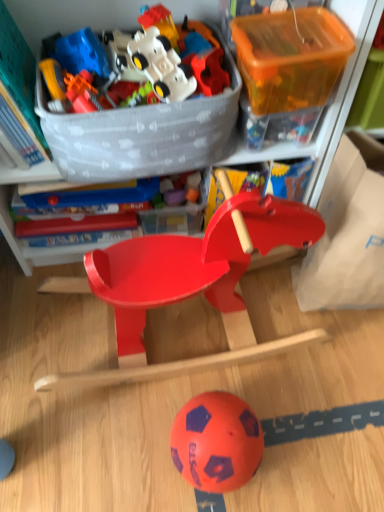
Find the location of a particular element. This screenshot has width=384, height=512. orange rubber ball at lower center is located at coordinates (216, 442).

Locate an element on the screen. translucent plastic storage box at upper center, which appears as the third storage box when viewed from the right is located at coordinates (179, 214).

The height and width of the screenshot is (512, 384). What are the coordinates of `white plastic toy car at upper center, acting as the third toy starting from the top` in the screenshot? It's located at (138, 60).

Identify the location of translucent plastic toy at upper left, which appears as the second toy when ordered from the bottom. This screenshot has width=384, height=512. (80, 92).

Where is `orange rubber ball at lower center`? The width and height of the screenshot is (384, 512). orange rubber ball at lower center is located at coordinates (x=216, y=442).

Which object is thinner, white matte plastic toy car at upper center, the 1th toy when ordered from top to bottom, or translucent plastic storage box at upper center, which is the 1th storage box from left to right?

white matte plastic toy car at upper center, the 1th toy when ordered from top to bottom, is thinner.

Considering the relative positions of white matte plastic toy car at upper center, the 1th toy when ordered from top to bottom, and translucent plastic storage box at upper center, which is the 1th storage box from left to right, in the image provided, is white matte plastic toy car at upper center, the 1th toy when ordered from top to bottom, in front of translucent plastic storage box at upper center, which is the 1th storage box from left to right,?

Yes.

From the image's perspective, is white matte plastic toy car at upper center, the 1th toy when ordered from top to bottom, below translucent plastic storage box at upper center, which is the 1th storage box from left to right?

No, from the image's perspective, white matte plastic toy car at upper center, the 1th toy when ordered from top to bottom, is not beneath translucent plastic storage box at upper center, which is the 1th storage box from left to right.

Can you confirm if white matte plastic toy car at upper center, the 1th toy when ordered from top to bottom, is shorter than translucent plastic storage box at upper center, which appears as the third storage box when viewed from the right?

Correct, white matte plastic toy car at upper center, the 1th toy when ordered from top to bottom, is not as tall as translucent plastic storage box at upper center, which appears as the third storage box when viewed from the right.

Could you tell me if rubberized plastic toy at upper center, the 4th toy viewed from the top, is turned towards translucent plastic toy at upper left, the 5th toy in the top-to-bottom sequence?

No, rubberized plastic toy at upper center, the 4th toy viewed from the top, is not turned towards translucent plastic toy at upper left, the 5th toy in the top-to-bottom sequence.

From a real-world perspective, is rubberized plastic toy at upper center, the third toy when ordered from bottom to top, located beneath translucent plastic toy at upper left, which appears as the second toy when ordered from the bottom?

No.

Considering their positions, is rubberized plastic toy at upper center, the third toy when ordered from bottom to top, located in front of or behind translucent plastic toy at upper left, the 5th toy in the top-to-bottom sequence?

In the image, rubberized plastic toy at upper center, the third toy when ordered from bottom to top, appears behind translucent plastic toy at upper left, the 5th toy in the top-to-bottom sequence.

Considering the relative sizes of matte plastic storage box at right, arranged as the first storage box when viewed from the right, and white matte plastic toy car at upper center, the 1th toy when ordered from top to bottom, in the image provided, is matte plastic storage box at right, arranged as the first storage box when viewed from the right, smaller than white matte plastic toy car at upper center, the 1th toy when ordered from top to bottom,?

Actually, matte plastic storage box at right, arranged as the first storage box when viewed from the right, might be larger than white matte plastic toy car at upper center, the 1th toy when ordered from top to bottom.

Consider the image. From the image's perspective, is matte plastic storage box at right, arranged as the first storage box when viewed from the right, on top of white matte plastic toy car at upper center, the 1th toy when ordered from top to bottom?

No, from the image's perspective, matte plastic storage box at right, arranged as the first storage box when viewed from the right, is not above white matte plastic toy car at upper center, the 1th toy when ordered from top to bottom.

Locate an element on the screen. Image resolution: width=384 pixels, height=512 pixels. storage box that is the 3rd object located below the white matte plastic toy car at upper center, the 1th toy when ordered from top to bottom (from the image's perspective) is located at coordinates (346, 239).

Between matte plastic storage box at right, arranged as the first storage box when viewed from the right, and white matte plastic toy car at upper center, the 1th toy when ordered from top to bottom, which one appears on the left side from the viewer's perspective?

From the viewer's perspective, white matte plastic toy car at upper center, the 1th toy when ordered from top to bottom, appears more on the left side.

Can you tell me how much white matte plastic toy car at upper center, the 1th toy when ordered from top to bottom, and translucent plastic toy at upper left, the 5th toy in the top-to-bottom sequence, differ in facing direction?

The angular difference between white matte plastic toy car at upper center, the 1th toy when ordered from top to bottom, and translucent plastic toy at upper left, the 5th toy in the top-to-bottom sequence, is 5.6e-05 degrees.

Which is less distant, (156, 15) or (85, 82)?

Clearly, point (156, 15) is more distant from the camera than point (85, 82).

Is white matte plastic toy car at upper center, the 1th toy when ordered from top to bottom, at the left side of translucent plastic toy at upper left, the 5th toy in the top-to-bottom sequence?

No, white matte plastic toy car at upper center, the 1th toy when ordered from top to bottom, is not to the left of translucent plastic toy at upper left, the 5th toy in the top-to-bottom sequence.

Is white matte plastic toy car at upper center, the 1th toy when ordered from top to bottom, turned away from translucent plastic toy at upper left, the 5th toy in the top-to-bottom sequence?

No, translucent plastic toy at upper left, the 5th toy in the top-to-bottom sequence, is not at the back of white matte plastic toy car at upper center, the 1th toy when ordered from top to bottom.

Between rubberized plastic toy at upper center, the 4th toy viewed from the top, and matte plastic toy car at upper center, which is the fifth toy in bottom-to-top order, which one appears on the right side from the viewer's perspective?

rubberized plastic toy at upper center, the 4th toy viewed from the top, is more to the right.

Is there a large distance between rubberized plastic toy at upper center, the third toy when ordered from bottom to top, and matte plastic toy car at upper center, which is the fifth toy in bottom-to-top order?

Actually, rubberized plastic toy at upper center, the third toy when ordered from bottom to top, and matte plastic toy car at upper center, which is the fifth toy in bottom-to-top order, are a little close together.

Can you confirm if rubberized plastic toy at upper center, the 4th toy viewed from the top, is shorter than matte plastic toy car at upper center, which ranks as the second toy in top-to-bottom order?

No.

Does matte plastic toy car at upper center, which is the fifth toy in bottom-to-top order, have a larger size compared to rubberized plastic toy at upper center, the 4th toy viewed from the top?

Actually, matte plastic toy car at upper center, which is the fifth toy in bottom-to-top order, might be smaller than rubberized plastic toy at upper center, the 4th toy viewed from the top.

Considering the sizes of objects matte plastic toy car at upper center, which is the fifth toy in bottom-to-top order, and rubberized plastic toy at upper center, the 4th toy viewed from the top, in the image provided, who is thinner, matte plastic toy car at upper center, which is the fifth toy in bottom-to-top order, or rubberized plastic toy at upper center, the 4th toy viewed from the top,?

matte plastic toy car at upper center, which is the fifth toy in bottom-to-top order, is thinner.

Who is more distant, matte plastic toy car at upper center, which is the fifth toy in bottom-to-top order, or rubberized plastic toy at upper center, the 4th toy viewed from the top?

matte plastic toy car at upper center, which is the fifth toy in bottom-to-top order, is further away from the camera.

Considering the positions of point (202, 48) and point (216, 56), is point (202, 48) closer or farther from the camera than point (216, 56)?

Point (202, 48) is positioned closer to the camera compared to point (216, 56).

Is matte plastic rocking horse at center, the 6th toy viewed from the top, shorter than translucent orange plastic storage box at upper right, which ranks as the 2th storage box in right-to-left order?

Incorrect, the height of matte plastic rocking horse at center, the 6th toy viewed from the top, does not fall short of that of translucent orange plastic storage box at upper right, which ranks as the 2th storage box in right-to-left order.

In the scene shown: Is matte plastic rocking horse at center, the 6th toy viewed from the top, to the left of translucent orange plastic storage box at upper right, which ranks as the 2th storage box in right-to-left order, from the viewer's perspective?

Yes.

There is a matte plastic rocking horse at center, the 6th toy viewed from the top. Where is `the 3rd storage box above it (from the image's perspective)`? the 3rd storage box above it (from the image's perspective) is located at coordinates (290, 57).

Can you confirm if matte plastic rocking horse at center, the 6th toy viewed from the top, is wider than translucent orange plastic storage box at upper right, which appears as the 2th storage box when viewed from the left?

Yes.

I want to click on storage box that is the 3rd one below the white matte plastic toy car at upper center, the 1th toy when ordered from top to bottom (from a real-world perspective), so click(x=179, y=214).

This screenshot has width=384, height=512. I want to click on the 5th toy counting from the right of the translucent plastic toy at upper left, which appears as the second toy when ordered from the bottom, so click(x=210, y=72).

Estimate the real-world distances between objects in this image. Which object is closer to matte plastic storage box at right, arranged as the first storage box when viewed from the right, translucent plastic storage box at upper center, which appears as the third storage box when viewed from the right, or matte plastic rocking horse at center, marked as the first toy in a bottom-to-top arrangement?

matte plastic rocking horse at center, marked as the first toy in a bottom-to-top arrangement.

Which object lies nearer to the anchor point rubberized plastic toy at upper center, the 4th toy viewed from the top, matte plastic rocking horse at center or orange rubber ball at lower center?

Among the two, matte plastic rocking horse at center is located nearer to rubberized plastic toy at upper center, the 4th toy viewed from the top.

Based on their spatial positions, is white matte plastic toy car at upper center, the 1th toy when ordered from top to bottom, or matte plastic toy car at upper center, which is the fifth toy in bottom-to-top order, further from translucent plastic toy at upper left, the 5th toy in the top-to-bottom sequence?

matte plastic toy car at upper center, which is the fifth toy in bottom-to-top order.

From the image, which object appears to be farther from white plastic toy car at upper center, the 4th toy when ordered from bottom to top, matte plastic rocking horse at center or white matte plastic toy car at upper center, the 6th toy positioned from the bottom?

Based on the image, matte plastic rocking horse at center appears to be further to white plastic toy car at upper center, the 4th toy when ordered from bottom to top.

When comparing their distances from matte plastic toy car at upper center, which is the fifth toy in bottom-to-top order, does translucent plastic storage box at upper center, which is the 1th storage box from left to right, or translucent plastic toy at upper left, the 5th toy in the top-to-bottom sequence, seem closer?

translucent plastic toy at upper left, the 5th toy in the top-to-bottom sequence, is positioned closer to the anchor matte plastic toy car at upper center, which is the fifth toy in bottom-to-top order.

Looking at the image, which one is located further to matte plastic storage box at right, arranged as the first storage box when viewed from the right, matte plastic rocking horse at center, marked as the first toy in a bottom-to-top arrangement, or translucent plastic storage box at upper center, which is the 1th storage box from left to right?

Based on the image, translucent plastic storage box at upper center, which is the 1th storage box from left to right, appears to be further to matte plastic storage box at right, arranged as the first storage box when viewed from the right.

Based on their spatial positions, is white matte plastic toy car at upper center, the 1th toy when ordered from top to bottom, or matte plastic rocking horse at center closer to matte plastic storage box at right, which ranks as the third storage box in left-to-right order?

matte plastic rocking horse at center lies closer to matte plastic storage box at right, which ranks as the third storage box in left-to-right order, than the other object.

From the image, which object appears to be farther from orange rubber ball at lower center, matte plastic rocking horse at center or translucent plastic storage box at upper center, which appears as the third storage box when viewed from the right?

matte plastic rocking horse at center lies further to orange rubber ball at lower center than the other object.

Where is `toy between translucent plastic toy at upper left, the 5th toy in the top-to-bottom sequence, and white plastic toy car at upper center, acting as the third toy starting from the top, in the horizontal direction`? This screenshot has width=384, height=512. toy between translucent plastic toy at upper left, the 5th toy in the top-to-bottom sequence, and white plastic toy car at upper center, acting as the third toy starting from the top, in the horizontal direction is located at coordinates (159, 22).

Where is `cabinetry between translucent plastic toy at upper left, which appears as the second toy when ordered from the bottom, and matte plastic storage box at right, which ranks as the third storage box in left-to-right order, in the horizontal direction`? cabinetry between translucent plastic toy at upper left, which appears as the second toy when ordered from the bottom, and matte plastic storage box at right, which ranks as the third storage box in left-to-right order, in the horizontal direction is located at coordinates (334, 102).

Find the location of a particular element. Image resolution: width=384 pixels, height=512 pixels. cabinetry between translucent plastic toy at upper left, which appears as the second toy when ordered from the bottom, and matte plastic rocking horse at center, marked as the first toy in a bottom-to-top arrangement, from top to bottom is located at coordinates (334, 102).

The image size is (384, 512). Find the location of `storage box located between translucent plastic toy at upper left, which appears as the second toy when ordered from the bottom, and translucent orange plastic storage box at upper right, which appears as the 2th storage box when viewed from the left, in the left-right direction`. storage box located between translucent plastic toy at upper left, which appears as the second toy when ordered from the bottom, and translucent orange plastic storage box at upper right, which appears as the 2th storage box when viewed from the left, in the left-right direction is located at coordinates (179, 214).